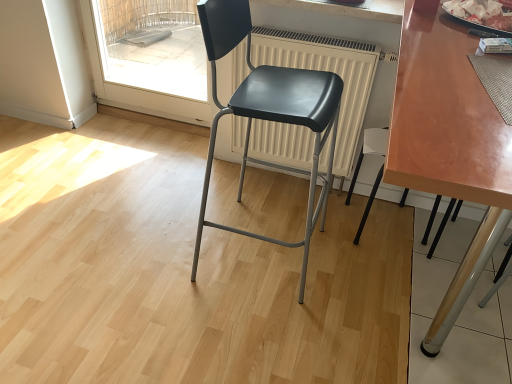
Image resolution: width=512 pixels, height=384 pixels. In order to click on vacant space that's between shiny brown table at center and matte black chair at lower right, which appears as the 2th chair when viewed from the left in this screenshot , I will do `click(329, 287)`.